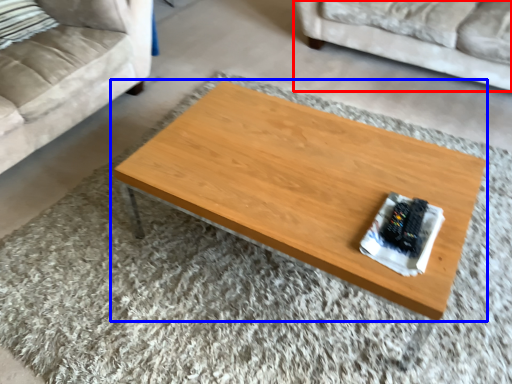
Question: Which of the following is the farthest to the observer, studio couch (highlighted by a red box) or coffee table (highlighted by a blue box)?

Choices:
 (A) studio couch
 (B) coffee table

Answer: (A)